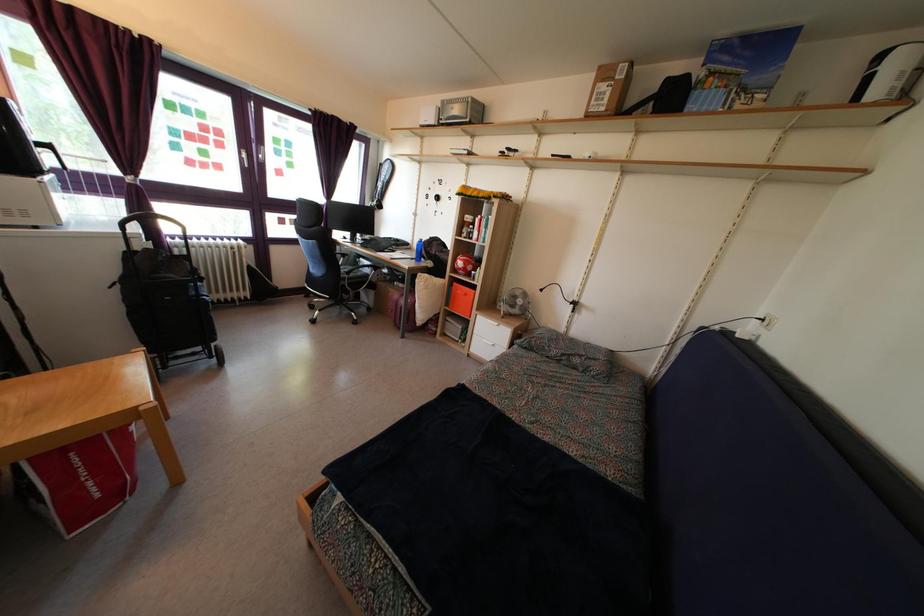
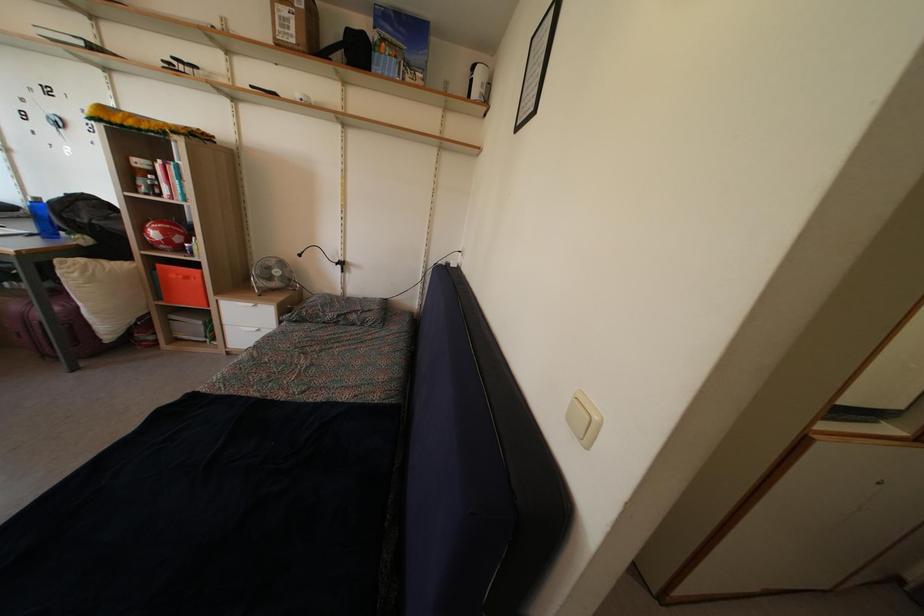
Where in the second image is the point corresponding to point 423,249 from the first image?

(40, 208)